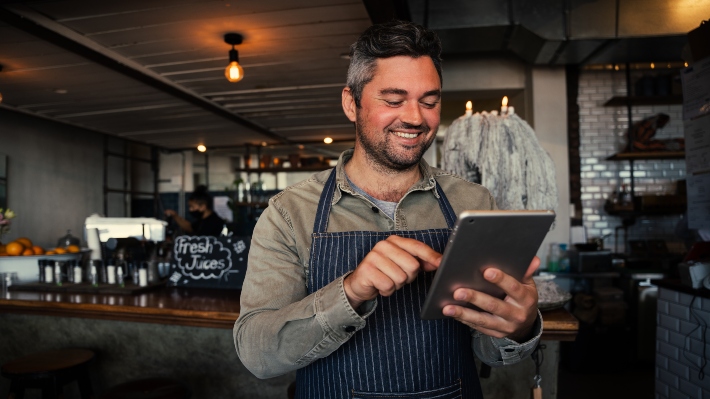
Locate an element on the screen. The height and width of the screenshot is (399, 710). lights is located at coordinates (240, 71), (204, 146), (329, 139).